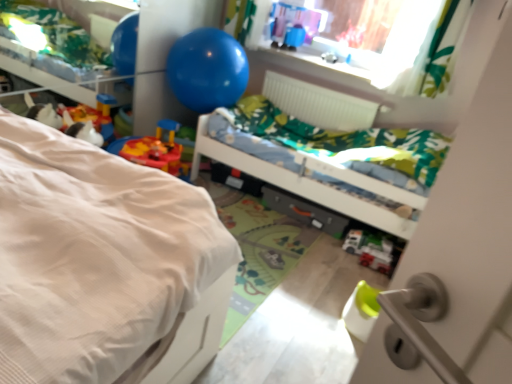
Locate an element on the screen. This screenshot has width=512, height=384. metallic gray drawer at center is located at coordinates tap(304, 211).

Consider the image. Measure the distance between white plastic toy car at lower center, the 2th toy viewed from the back, and camera.

white plastic toy car at lower center, the 2th toy viewed from the back, and camera are 2.46 meters apart from each other.

Image resolution: width=512 pixels, height=384 pixels. What do you see at coordinates (318, 104) in the screenshot? I see `white plastic radiator at upper center` at bounding box center [318, 104].

Describe the element at coordinates (207, 70) in the screenshot. I see `blue rubber balloon at upper center` at that location.

Where is `green fabric bed at center, which is the first bed from back to front`? green fabric bed at center, which is the first bed from back to front is located at coordinates (323, 178).

Is white plastic toy car at lower center, placed as the 2th toy when sorted from left to right, a part of white textured bed at left, positioned as the first bed in front-to-back order?

No.

Which of these two, white textured bed at left, the second bed viewed from the back, or white plastic toy car at lower center, placed as the 1th toy when sorted from bottom to top, is smaller?

white plastic toy car at lower center, placed as the 1th toy when sorted from bottom to top.

Is white textured bed at left, the second bed viewed from the back, turned away from white plastic toy car at lower center, marked as the 1th toy in a right-to-left arrangement?

No.

In the scene shown: Does blue rubber balloon at upper center have a greater height compared to matte plastic toy at upper center, which appears as the second toy when ordered from the bottom?

Yes, blue rubber balloon at upper center is taller than matte plastic toy at upper center, which appears as the second toy when ordered from the bottom.

From a real-world perspective, is blue rubber balloon at upper center below matte plastic toy at upper center, positioned as the second toy in right-to-left order?

Yes, from a real-world perspective, blue rubber balloon at upper center is below matte plastic toy at upper center, positioned as the second toy in right-to-left order.

Is blue rubber balloon at upper center located outside matte plastic toy at upper center, positioned as the second toy in front-to-back order?

Yes, blue rubber balloon at upper center is not within matte plastic toy at upper center, positioned as the second toy in front-to-back order.

Based on the photo, considering the sizes of objects blue rubber balloon at upper center and matte plastic toy at upper center, which appears as the second toy when ordered from the bottom, in the image provided, who is bigger, blue rubber balloon at upper center or matte plastic toy at upper center, which appears as the second toy when ordered from the bottom,?

Bigger between the two is blue rubber balloon at upper center.

Is white plastic toy car at lower center, placed as the 1th toy when sorted from bottom to top, located within green fabric bed at center, which is the first bed from back to front?

Yes, white plastic toy car at lower center, placed as the 1th toy when sorted from bottom to top, can be found within green fabric bed at center, which is the first bed from back to front.

Considering the sizes of objects green fabric bed at center, which is the 2th bed in front-to-back order, and white plastic toy car at lower center, the 2th toy viewed from the back, in the image provided, who is smaller, green fabric bed at center, which is the 2th bed in front-to-back order, or white plastic toy car at lower center, the 2th toy viewed from the back,?

white plastic toy car at lower center, the 2th toy viewed from the back, is smaller.

Considering the positions of objects green fabric bed at center, which is the 2th bed in front-to-back order, and white plastic toy car at lower center, placed as the 1th toy when sorted from bottom to top, in the image provided, who is more to the right, green fabric bed at center, which is the 2th bed in front-to-back order, or white plastic toy car at lower center, placed as the 1th toy when sorted from bottom to top,?

white plastic toy car at lower center, placed as the 1th toy when sorted from bottom to top.

Locate an element on the screen. The image size is (512, 384). drawer above the white textured bed at left, the second bed viewed from the back (from the image's perspective) is located at coordinates (304, 211).

Is white textured bed at left, the second bed viewed from the back, next to metallic gray drawer at center?

No, white textured bed at left, the second bed viewed from the back, is not with metallic gray drawer at center.

Can we say white textured bed at left, the second bed viewed from the back, lies outside metallic gray drawer at center?

Indeed, white textured bed at left, the second bed viewed from the back, is completely outside metallic gray drawer at center.

From their relative heights in the image, would you say white textured bed at left, positioned as the first bed in front-to-back order, is taller or shorter than metallic gray drawer at center?

Considering their sizes, white textured bed at left, positioned as the first bed in front-to-back order, has more height than metallic gray drawer at center.

Which is closer to the camera, [343,166] or [74,327]?

The point [74,327] is in front.

Considering the positions of objects green fabric bed at center, which is the first bed from back to front, and white textured bed at left, the second bed viewed from the back, in the image provided, who is more to the left, green fabric bed at center, which is the first bed from back to front, or white textured bed at left, the second bed viewed from the back,?

Positioned to the left is white textured bed at left, the second bed viewed from the back.

Between green fabric bed at center, which is the first bed from back to front, and white textured bed at left, the second bed viewed from the back, which one has more height?

With more height is white textured bed at left, the second bed viewed from the back.

Can you tell me how much green fabric bed at center, which is the first bed from back to front, and white textured bed at left, the second bed viewed from the back, differ in facing direction?

There is a 180-degree angle between the facing directions of green fabric bed at center, which is the first bed from back to front, and white textured bed at left, the second bed viewed from the back.

Consider the image. Can you confirm if white plastic radiator at upper center is shorter than blue rubber balloon at upper center?

Yes, white plastic radiator at upper center is shorter than blue rubber balloon at upper center.

Considering the relative positions of white plastic radiator at upper center and blue rubber balloon at upper center in the image provided, is white plastic radiator at upper center to the left or to the right of blue rubber balloon at upper center?

In the image, white plastic radiator at upper center appears on the right side of blue rubber balloon at upper center.

Based on the photo, from a real-world perspective, is white plastic radiator at upper center on blue rubber balloon at upper center?

No, from a real-world perspective, white plastic radiator at upper center is not above blue rubber balloon at upper center.

Is white plastic radiator at upper center placed right next to blue rubber balloon at upper center?

No.

Which is less distant, (301,198) or (356,126)?

Point (301,198)

Which of these two, metallic gray drawer at center or white plastic radiator at upper center, stands shorter?

With less height is metallic gray drawer at center.

Considering the relative sizes of metallic gray drawer at center and white plastic radiator at upper center in the image provided, is metallic gray drawer at center thinner than white plastic radiator at upper center?

Yes.

Considering the positions of objects metallic gray drawer at center and white plastic radiator at upper center in the image provided, who is in front, metallic gray drawer at center or white plastic radiator at upper center?

metallic gray drawer at center is closer to the camera.

Where is `toy below the white textured bed at left, positioned as the first bed in front-to-back order (from the image's perspective)`? toy below the white textured bed at left, positioned as the first bed in front-to-back order (from the image's perspective) is located at coordinates (377, 256).

This screenshot has width=512, height=384. What are the coordinates of `balloon on the left side of matte plastic toy at upper center, the first toy from the left` in the screenshot? It's located at (207, 70).

Which object lies nearer to the anchor point white plastic toy car at lower center, marked as the 1th toy in a right-to-left arrangement, matte plastic toy at upper center, positioned as the second toy in right-to-left order, or metallic gray drawer at center?

metallic gray drawer at center lies closer to white plastic toy car at lower center, marked as the 1th toy in a right-to-left arrangement, than the other object.

Estimate the real-world distances between objects in this image. Which object is further from white plastic toy car at lower center, marked as the 1th toy in a right-to-left arrangement, green fabric bed at center, which is the 2th bed in front-to-back order, or white textured bed at left, the second bed viewed from the back?

white textured bed at left, the second bed viewed from the back, is positioned further to the anchor white plastic toy car at lower center, marked as the 1th toy in a right-to-left arrangement.

Considering their positions, is metallic gray drawer at center positioned closer to matte plastic toy at upper center, which is counted as the 1th toy, starting from the top, than white plastic radiator at upper center?

The object closer to matte plastic toy at upper center, which is counted as the 1th toy, starting from the top, is white plastic radiator at upper center.

Looking at the image, which one is located closer to blue rubber balloon at upper center, green fabric bed at center, which is the first bed from back to front, or matte plastic toy at upper center, the first toy from the left?

green fabric bed at center, which is the first bed from back to front, is closer to blue rubber balloon at upper center.

From the image, which object appears to be farther from blue rubber balloon at upper center, matte plastic toy at upper center, positioned as the second toy in front-to-back order, or white plastic radiator at upper center?

matte plastic toy at upper center, positioned as the second toy in front-to-back order.

When comparing their distances from white plastic toy car at lower center, the 2th toy viewed from the back, does metallic gray drawer at center or white plastic radiator at upper center seem further?

white plastic radiator at upper center is further to white plastic toy car at lower center, the 2th toy viewed from the back.

Looking at the image, which one is located further to white plastic toy car at lower center, placed as the 1th toy when sorted from bottom to top, white plastic radiator at upper center or blue rubber balloon at upper center?

blue rubber balloon at upper center lies further to white plastic toy car at lower center, placed as the 1th toy when sorted from bottom to top, than the other object.

From the image, which object appears to be farther from metallic gray drawer at center, green fabric bed at center, which is the 2th bed in front-to-back order, or white plastic toy car at lower center, the 2th toy viewed from the back?

Among the two, white plastic toy car at lower center, the 2th toy viewed from the back, is located further to metallic gray drawer at center.

Where is `toy positioned between white textured bed at left, the second bed viewed from the back, and metallic gray drawer at center from near to far`? This screenshot has width=512, height=384. toy positioned between white textured bed at left, the second bed viewed from the back, and metallic gray drawer at center from near to far is located at coordinates (377, 256).

The height and width of the screenshot is (384, 512). I want to click on bed between white textured bed at left, positioned as the first bed in front-to-back order, and matte plastic toy at upper center, which is counted as the 1th toy, starting from the top, in the front-back direction, so click(323, 178).

Locate an element on the screen. radiator between matte plastic toy at upper center, which is counted as the 1th toy, starting from the top, and green fabric bed at center, which is the 2th bed in front-to-back order, in the up-down direction is located at coordinates (318, 104).

At what (x,y) coordinates should I click in order to perform the action: click on radiator between blue rubber balloon at upper center and white plastic toy car at lower center, placed as the 2th toy when sorted from left to right, vertically. Please return your answer as a coordinate pair (x, y). This screenshot has width=512, height=384. Looking at the image, I should click on (318, 104).